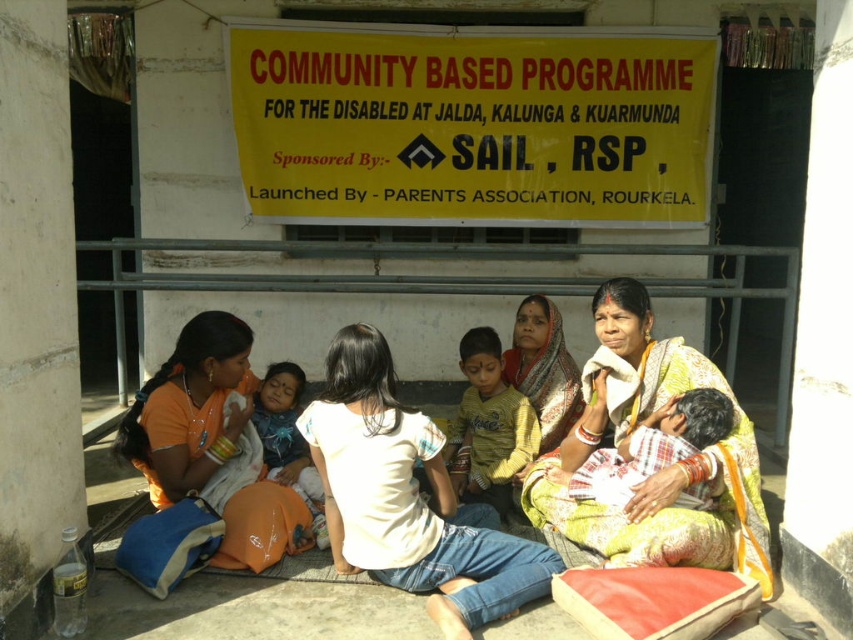
Which is more to the left, yellow printed sari at center or orange fabric at lower left?

Positioned to the left is orange fabric at lower left.

Between yellow printed sari at center and orange fabric at lower left, which one is positioned lower?

Positioned lower is orange fabric at lower left.

Is point (583, 540) farther from viewer compared to point (260, 481)?

No, it is not.

In order to click on yellow printed sari at center in this screenshot , I will do `click(666, 461)`.

How distant is yellow paper sign at upper center from white cotton shirt at center?

The distance of yellow paper sign at upper center from white cotton shirt at center is 8.25 feet.

Can you confirm if yellow paper sign at upper center is positioned to the left of white cotton shirt at center?

Yes, yellow paper sign at upper center is to the left of white cotton shirt at center.

Which is in front, point (479, 40) or point (685, 496)?

Point (685, 496) is in front.

The height and width of the screenshot is (640, 853). What are the coordinates of `yellow paper sign at upper center` in the screenshot? It's located at (471, 125).

Is white cotton saree at center positioned in front of yellow printed sari at center?

That is True.

Is white cotton saree at center thinner than yellow printed sari at center?

Incorrect, white cotton saree at center's width is not less than yellow printed sari at center's.

You are a GUI agent. You are given a task and a screenshot of the screen. Output one action in this format:
    pyautogui.click(x=<x>, y=<y>)
    Task: Click on the white cotton saree at center
    Image resolution: width=853 pixels, height=640 pixels.
    Given the screenshot: What is the action you would take?
    pyautogui.click(x=408, y=499)